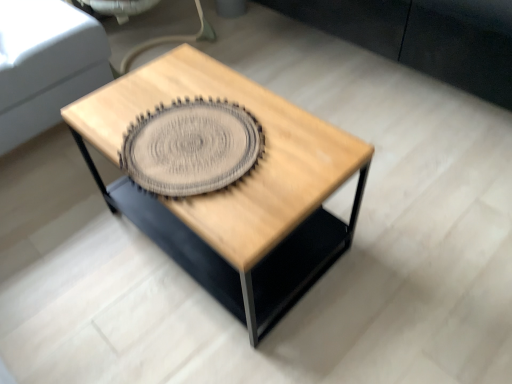
In order to click on empty space that is ontop of natural wood coffee table at center (from a real-world perspective) in this screenshot , I will do `click(212, 130)`.